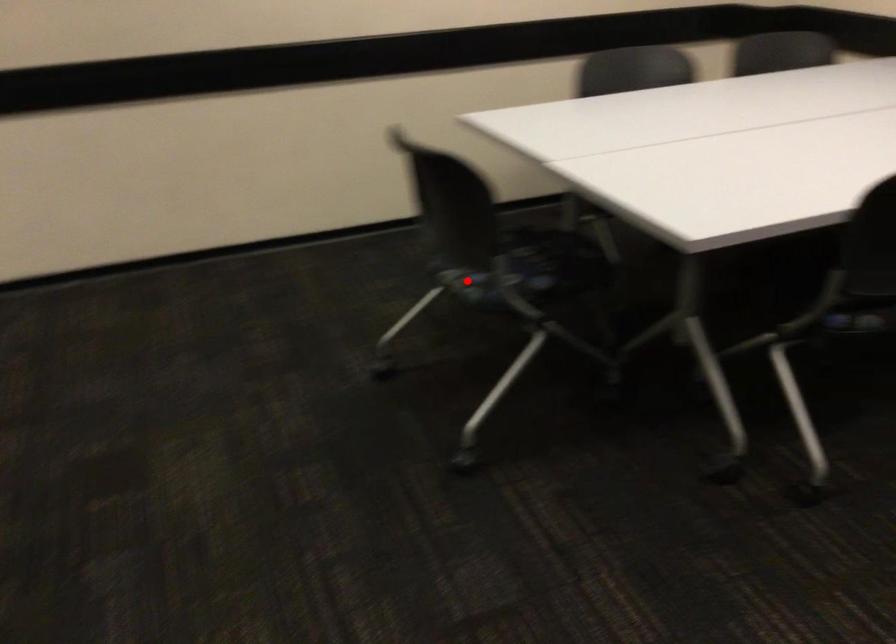
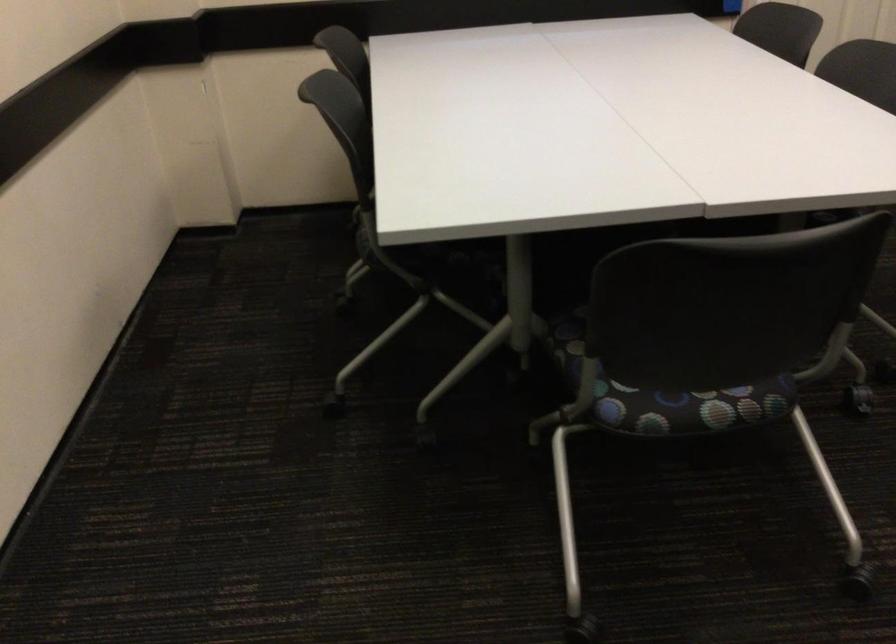
In the second image, find the point that corresponds to the highlighted location in the first image.

(688, 406)